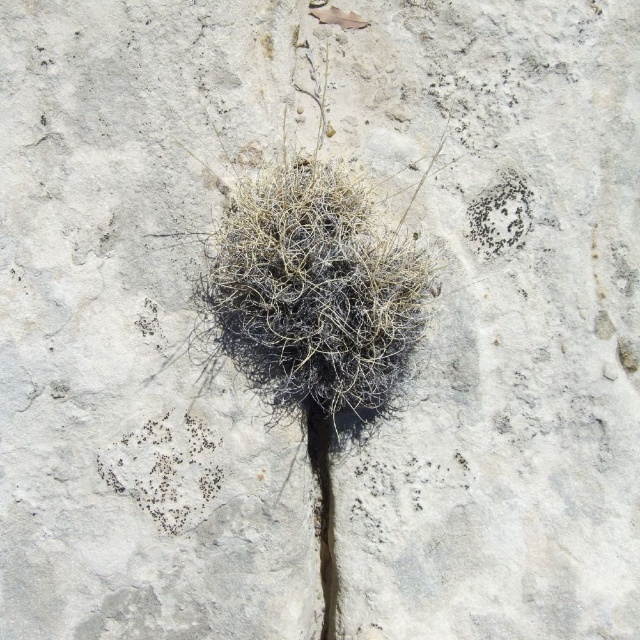
You are a geologist examining the image. You need to determine which black speckled rock is higher in elevation between the black speckled rock at lower left and the black speckled rock at upper right. Based on the spatial relationship in the image, which one is taller?

The black speckled rock at lower left is much taller than the black speckled rock at upper right according to the description.

Based on the scene description, which object, the fuzzy black plant at center or the black speckled rock at lower left, has a greater width?

The fuzzy black plant at center might be wider than black speckled rock at lower left.

You are examining the image of a rocky surface with scattered black specks and a cluster of dark brown and black plant material. There is a point labeled as point [316,291]. What does this point indicate?

Point [316,291] marks the fuzzy black plant at center.